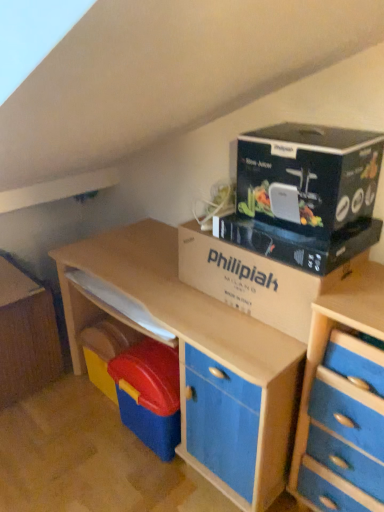
Question: Do you think blue wood chest of drawers at right is within cardboard box at center, or outside of it?

Choices:
 (A) inside
 (B) outside

Answer: (B)

Question: In the image, is blue wood chest of drawers at right on the left side or the right side of cardboard box at center?

Choices:
 (A) right
 (B) left

Answer: (A)

Question: Which object is positioned closest to the blue wood chest of drawers at right?

Choices:
 (A) black cardboard at upper right
 (B) cardboard box at center
 (C) blue matte file cabinet at lower left

Answer: (B)

Question: Which object is the farthest from the blue wood chest of drawers at right?

Choices:
 (A) cardboard box at center
 (B) black cardboard at upper right
 (C) blue matte file cabinet at lower left

Answer: (C)